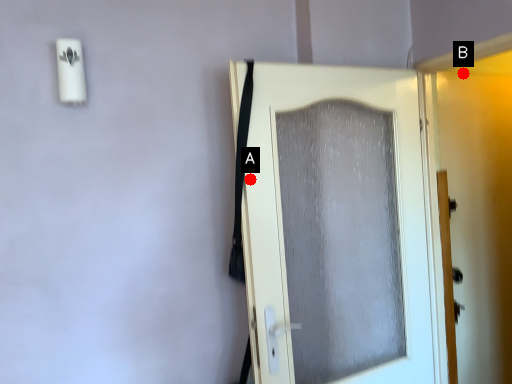
Question: Two points are circled on the image, labeled by A and B beside each circle. Among these points, which one is nearest to the camera?

Choices:
 (A) A is closer
 (B) B is closer

Answer: (A)